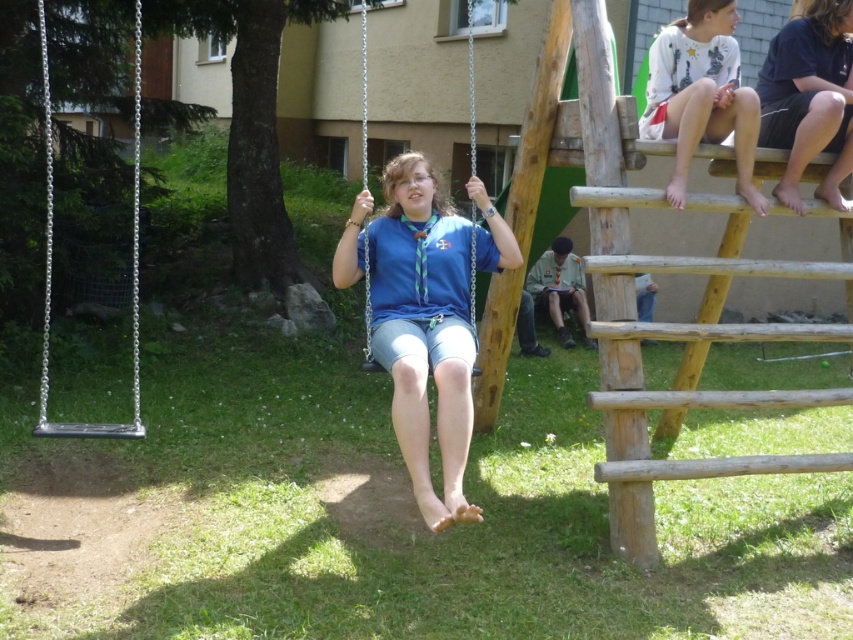
You are a safety inspector checking the distance between the black cotton shorts at upper right and the blue fabric swing at center. According to safety regulations, the minimum distance between any two play equipment must be at least 2 meters. Is the current distance compliant with the regulation?

The black cotton shorts at upper right and blue fabric swing at center are 2.27 meters apart, which exceeds the minimum required distance of 2 meters. Therefore, the current distance is compliant with the safety regulations.

You are a photographer trying to capture the blue fabric swing at center and the black cotton shorts at upper right in the same frame. Based on the scene, can you position yourself so that both objects are visible without one blocking the other?

The blue fabric swing at center is behind the black cotton shorts at upper right, so positioning yourself to the side or front of the black cotton shorts at upper right would allow you to see both objects without obstruction.

You are standing at the point labeled point (48,273) and want to walk to the point labeled point (462,388). Which direction should you face to walk directly towards your destination?

You should face north to walk directly towards point (462,388) from point (48,273).